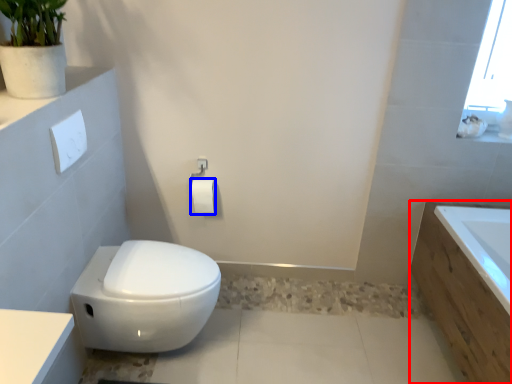
Question: Which object appears farthest to the camera in this image, bath (highlighted by a red box) or toilet paper (highlighted by a blue box)?

Choices:
 (A) bath
 (B) toilet paper

Answer: (B)